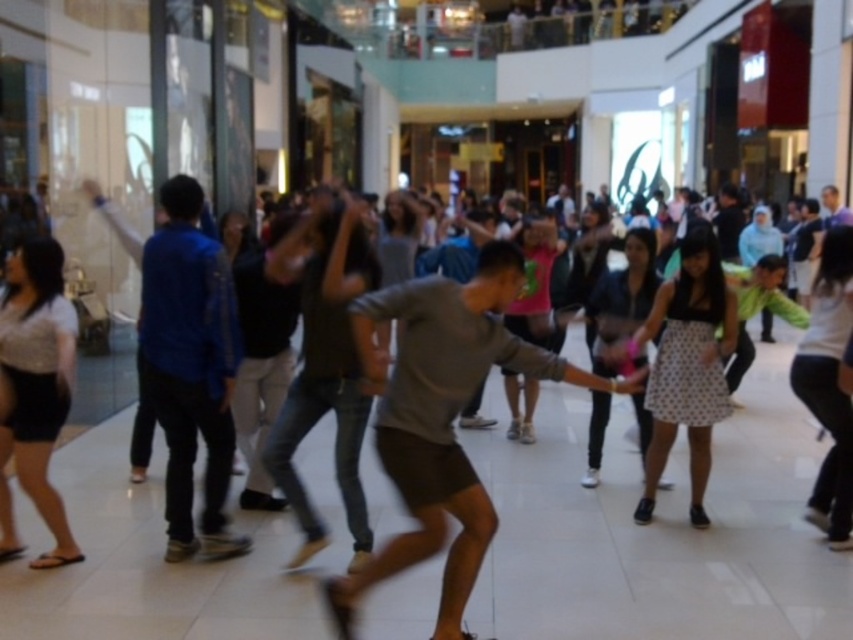
Question: Which object appears closest to the camera in this image?

Choices:
 (A) blue cotton shirt at left
 (B) gray matte shirt at center

Answer: (B)

Question: Which point is closer to the camera taking this photo?

Choices:
 (A) (198, 356)
 (B) (474, 284)

Answer: (B)

Question: From the image, what is the correct spatial relationship of gray matte shirt at center in relation to blue cotton shirt at left?

Choices:
 (A) above
 (B) below

Answer: (B)

Question: Is gray matte shirt at center to the right of blue cotton shirt at left from the viewer's perspective?

Choices:
 (A) yes
 (B) no

Answer: (A)

Question: Which point is farther to the camera?

Choices:
 (A) gray matte shirt at center
 (B) blue cotton shirt at left

Answer: (B)

Question: Can you confirm if gray matte shirt at center is wider than blue cotton shirt at left?

Choices:
 (A) no
 (B) yes

Answer: (B)